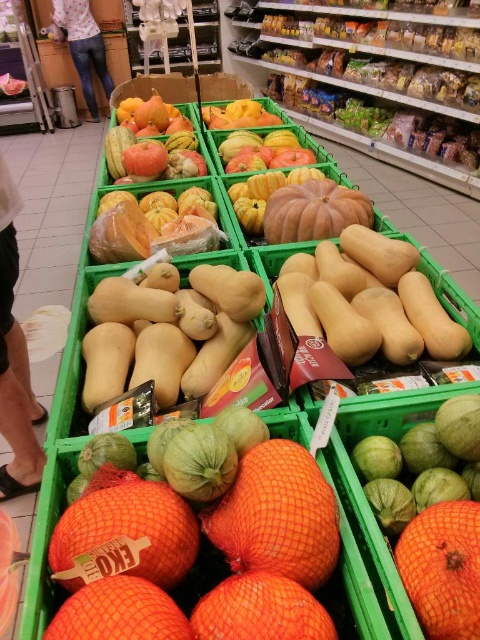
You are a grocery store employee who needs to place a new smooth yellow squash at center and an orange mesh grapefruit at center into a display. The shelf has limited space. Based on their sizes, which one should you place first to ensure both fit properly?

The smooth yellow squash at center is bigger than the orange mesh grapefruit at center, so you should place the smooth yellow squash at center first to ensure both fit properly.

You are a grocery store employee who needs to stack boxes on top of the orange mesh bag at center and the shiny orange melon at center. Which object can you safely place a box on top of without it falling over?

The shiny orange melon at center is taller than the orange mesh bag at center, so placing a box on top of the shiny orange melon at center would be more stable since it has a larger surface area and height to support the weight.

You are a grocery store employee trying to restock the display. You have an orange mesh bag at center and smooth yellow mangoes at center. Which item takes up more horizontal space in the display?

The smooth yellow mangoes at center take up more horizontal space because the orange mesh bag at center has a lesser width compared to them.